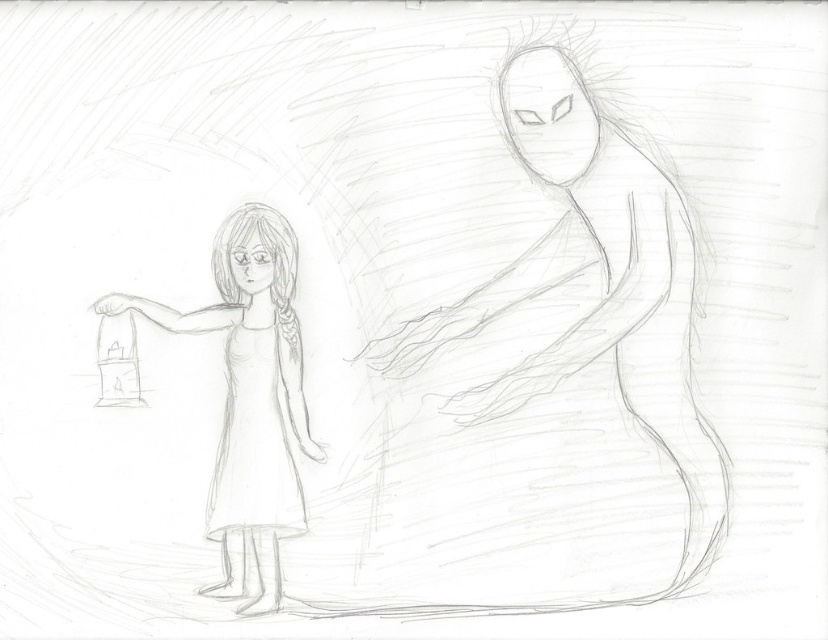
Who is lower down, smooth paper lantern at left or white paper dress at center?

Positioned lower is white paper dress at center.

Which of these two, smooth paper lantern at left or white paper dress at center, stands taller?

Standing taller between the two is smooth paper lantern at left.

This screenshot has width=828, height=640. Describe the element at coordinates (249, 401) in the screenshot. I see `smooth paper lantern at left` at that location.

Locate an element on the screen. smooth paper lantern at left is located at coordinates (249, 401).